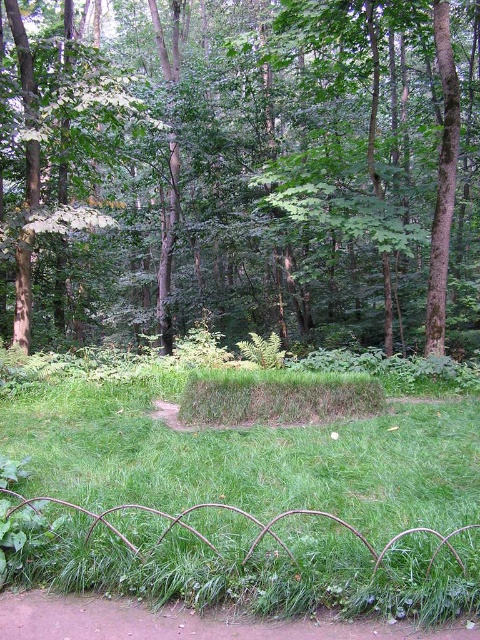
You are a hiker who wants to take a photo of the green leafy tree at center and the green grassy mound at center from a distance where both are clearly visible. Considering their heights, which object should you position closer to the camera to ensure both are fully visible in the frame?

The green leafy tree at center is taller than the green grassy mound at center. To ensure both are fully visible in the frame, you should position the green grassy mound at center closer to the camera so that its smaller height doesn

You are a hiker who wants to take a photo of the green leafy tree at center and the brown dirt path at lower left. Which object is wider?

The green leafy tree at center is wider than the brown dirt path at lower left.